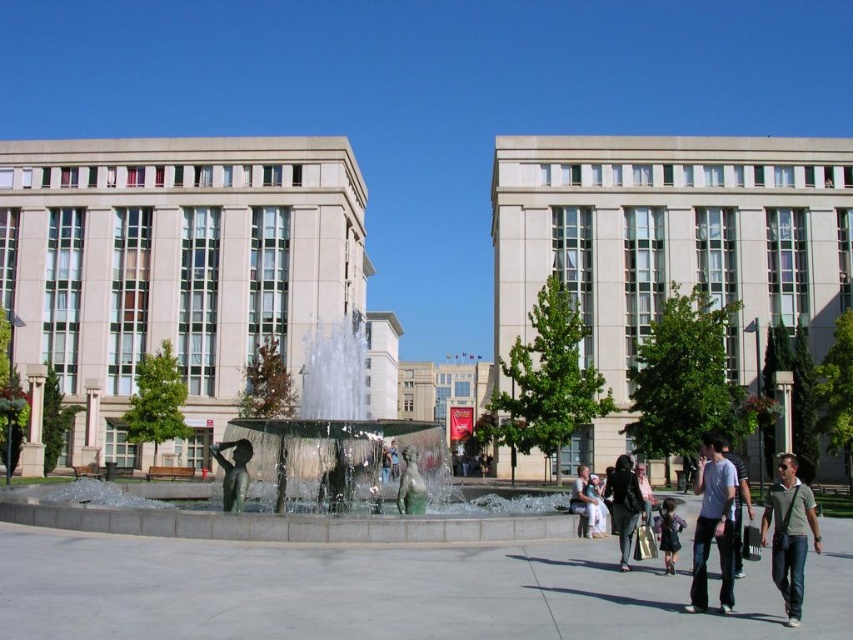
You are standing in the plaza and want to take a photo of the green polished water at center without including the dark blue denim jeans at lower right in the frame. Which direction should you move to ensure the jeans are out of the shot?

Move away from the dark blue denim jeans at lower right so that it becomes smaller in your viewfinder while keeping the green polished water at center in focus. Since the green polished water at center is closer to you than the dark blue denim jeans at lower right, moving away from the jeans could help exclude them from the frame.

You are a photographer positioned at the edge of the plaza, aiming to capture a clear photo of the light brown fabric dress at center without the bronze statue at center blocking it. What adjustment should you make to your camera angle?

To avoid the bronze statue at center blocking the light brown fabric dress at center, you should adjust your camera angle to look behind the bronze statue at center, as the light brown fabric dress at center is positioned behind it.